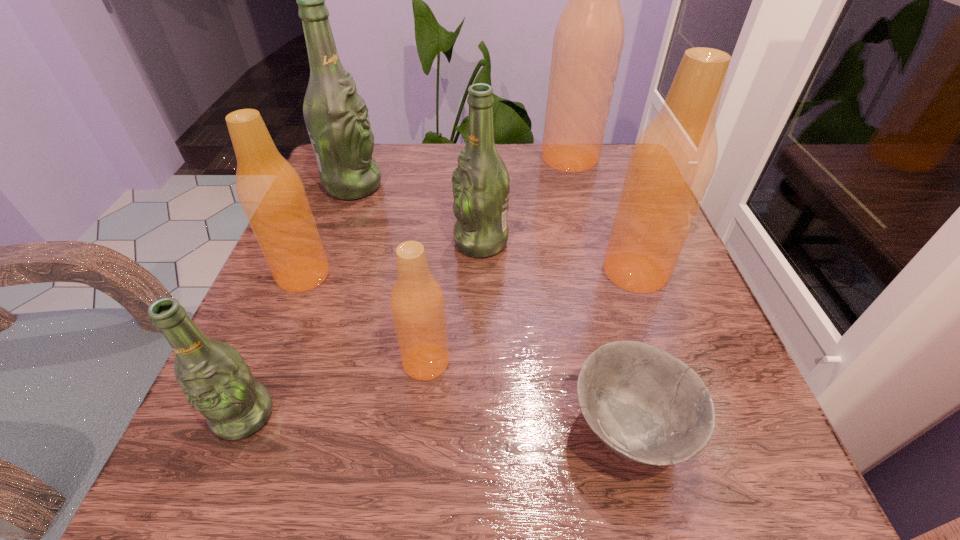
This screenshot has height=540, width=960. What are the coordinates of `free region located on the surface of the smallest green beer bottle` in the screenshot? It's located at (217, 483).

The width and height of the screenshot is (960, 540). I want to click on vacant region located on the right of the bowl, so [x=749, y=428].

This screenshot has width=960, height=540. I want to click on beer bottle that is at the near edge, so click(x=216, y=381).

You are a GUI agent. You are given a task and a screenshot of the screen. Output one action in this format:
    pyautogui.click(x=<x>, y=<y>)
    Task: Click on the bowl located at the near edge
    This screenshot has height=540, width=960.
    Given the screenshot: What is the action you would take?
    pyautogui.click(x=645, y=404)

Find the location of a particular element. This screenshot has width=960, height=540. bowl that is positioned at the right edge is located at coordinates (645, 404).

Where is `object present at the far left corner`? The image size is (960, 540). object present at the far left corner is located at coordinates (336, 116).

At what (x,y) coordinates should I click in order to perform the action: click on object that is at the near left corner. Please return your answer as a coordinate pair (x, y). Looking at the image, I should click on (216, 381).

This screenshot has width=960, height=540. In order to click on object positioned at the far right corner in this screenshot , I will do `click(588, 41)`.

The height and width of the screenshot is (540, 960). I want to click on object at the near right corner, so click(x=645, y=404).

The height and width of the screenshot is (540, 960). In the image, there is a desktop. In order to click on vacant space at the far edge in this screenshot , I will do `click(436, 160)`.